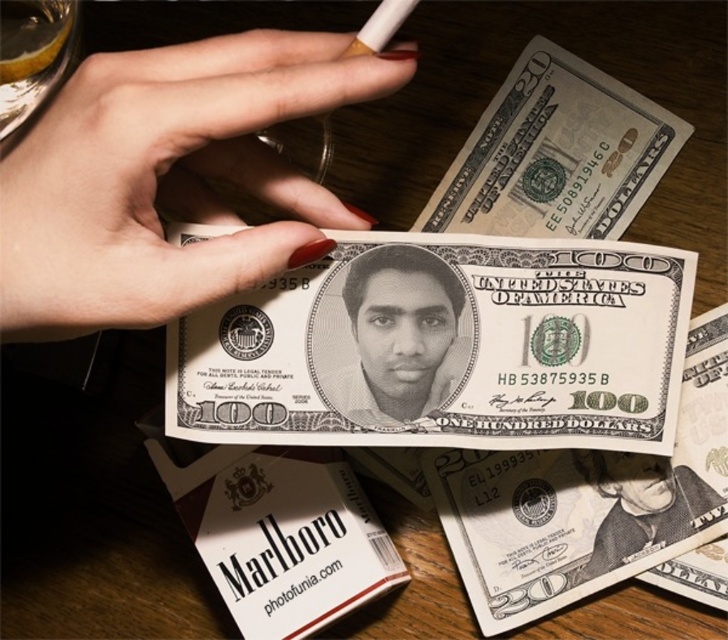
In the scene shown: You are a cashier at a store and need to verify the position of the green paper currency at upper right and the black matte portrait at center on the counter. Which one is placed higher up on the counter?

The green paper currency at upper right is located above the black matte portrait at center, so it is placed higher up on the counter.

In the scene shown: You are a cashier who needs to determine if the green paper currency at upper right can fit into a cash register slot designed for bills the size of the smooth paper money at center. Based on their sizes, will it fit?

The green paper currency at upper right has a larger width than the smooth paper money at center, so it will not fit into the cash register slot designed for the smaller size.